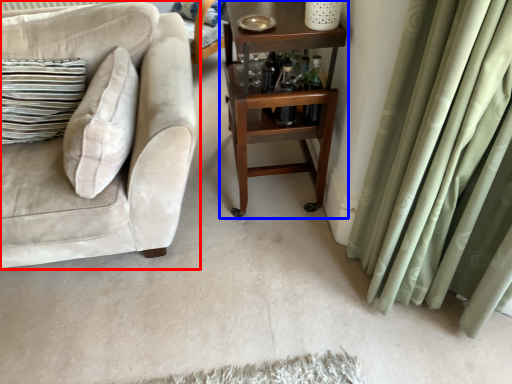
Question: Which of the following is the closest to the observer, studio couch (highlighted by a red box) or table (highlighted by a blue box)?

Choices:
 (A) studio couch
 (B) table

Answer: (A)